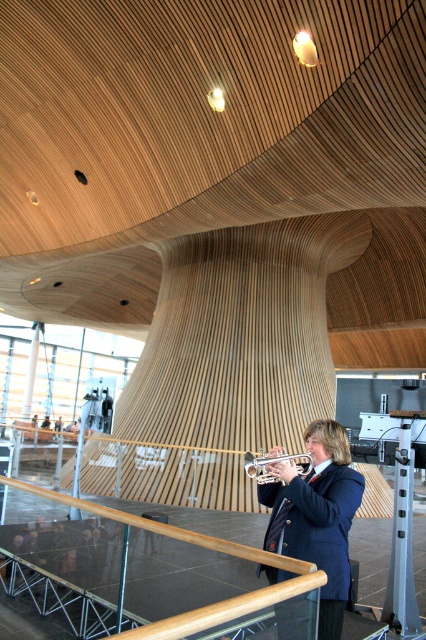
You are an event planner arranging a small performance space. You need to place a decorative stand between the shiny blue blazer at center and the wooden polished rail at center. Which object should the stand be closer to if it needs to be narrower than both?

The stand should be closer to the shiny blue blazer at center because it is thinner than the wooden polished rail at center, so the stand can fit between them while maintaining its narrow requirement.

You are a stagehand setting up for a performance. You need to ensure that the shiny blue blazer at center and the silver metallic trumpet at center are visible to the audience. Based on their heights, which object might block the view of the other?

The shiny blue blazer at center is taller than the silver metallic trumpet at center, so the blazer could potentially block the view of the trumpet if they are placed in a line of sight where the blazer is in front.

You are an event planner setting up a stage for a performance. The stage has a railing made of glass and a shiny blue blazer at center. Where is the shiny blue blazer positioned relative to the glass railing?

The shiny blue blazer at center is located at point (316,515), which is near the center of the stage, likely in front of the glass railing.